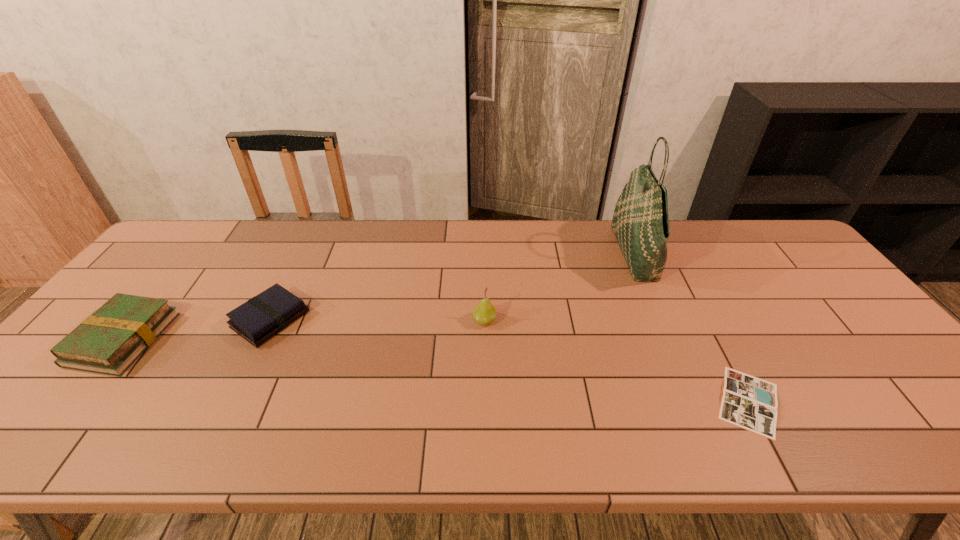
The image size is (960, 540). Find the location of `tote bag`. tote bag is located at coordinates 640,222.

You are a GUI agent. You are given a task and a screenshot of the screen. Output one action in this format:
    pyautogui.click(x=<x>, y=<y>)
    Task: Click on the tallest object
    The image size is (960, 540).
    Given the screenshot: What is the action you would take?
    pyautogui.click(x=640, y=222)

The height and width of the screenshot is (540, 960). Identify the location of pear. (484, 313).

In order to click on the second tallest object in this screenshot , I will do `click(484, 313)`.

Identify the location of the leftmost book. (109, 341).

At what (x,y) coordinates should I click in order to perform the action: click on the tallest book. Please return your answer as a coordinate pair (x, y). Looking at the image, I should click on (109, 341).

Identify the location of the second shortest book. (260, 318).

At what (x,y) coordinates should I click in order to perform the action: click on the second book from left to right. Please return your answer as a coordinate pair (x, y). The image size is (960, 540). Looking at the image, I should click on (260, 318).

At what (x,y) coordinates should I click in order to perform the action: click on the shortest book. Please return your answer as a coordinate pair (x, y). Looking at the image, I should click on (748, 402).

Find the location of a particular element. Image resolution: width=960 pixels, height=540 pixels. the shortest object is located at coordinates (748, 402).